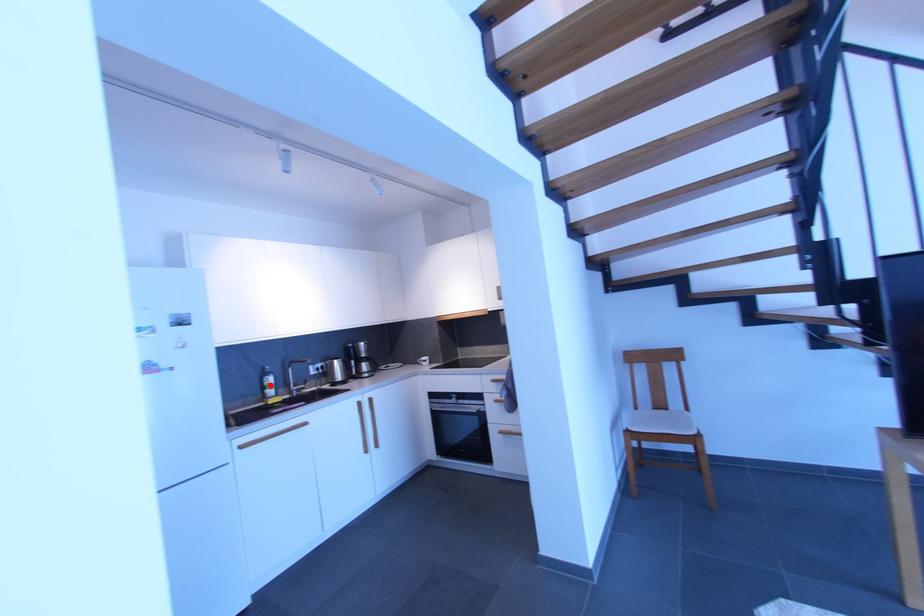
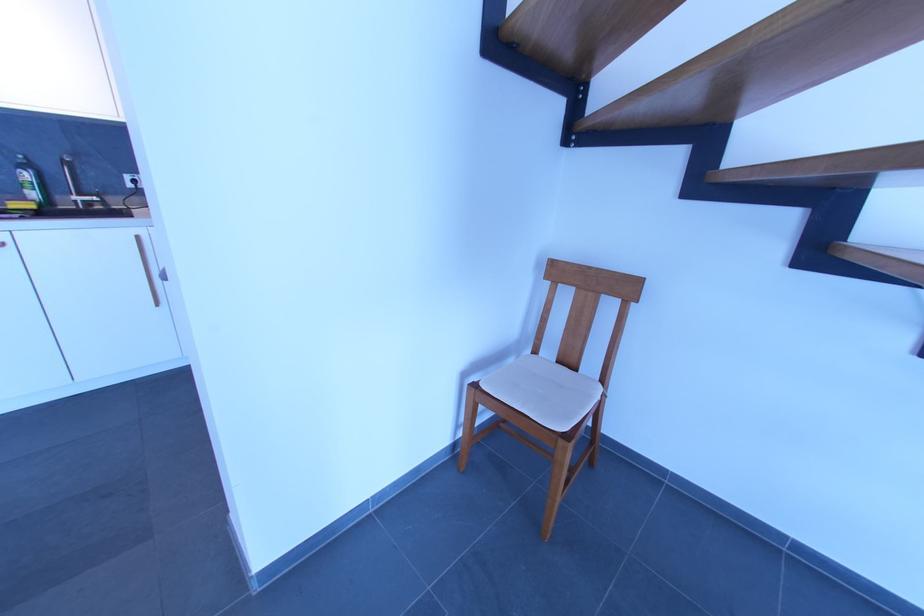
The point at the highlighted location is marked in the first image. Where is the corresponding point in the second image?

(26, 182)